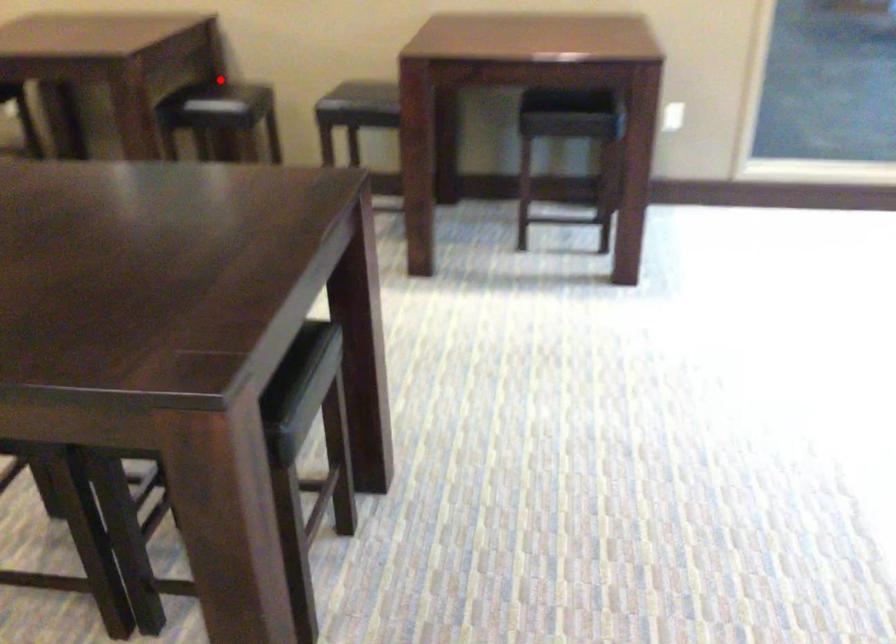
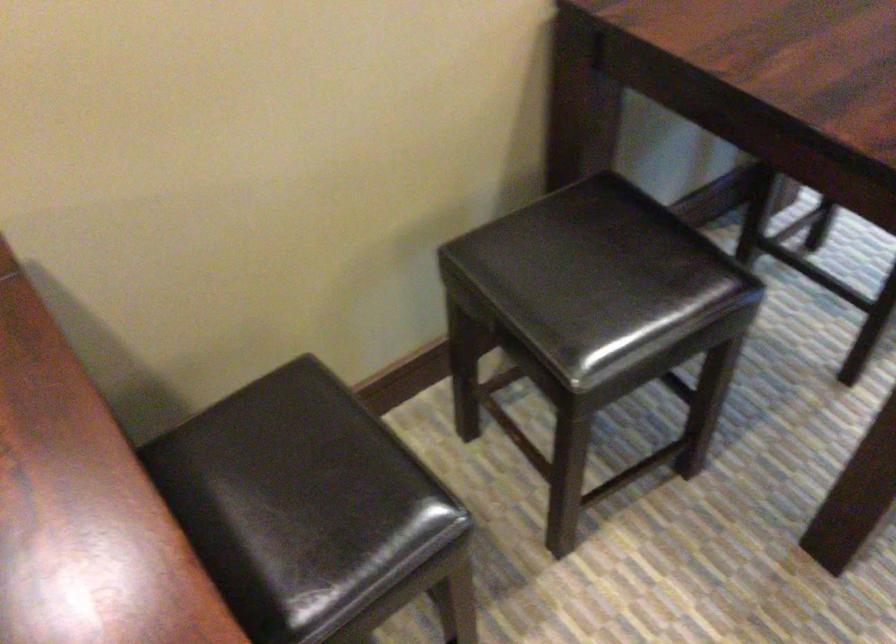
The point at the highlighted location is marked in the first image. Where is the corresponding point in the second image?

(286, 471)